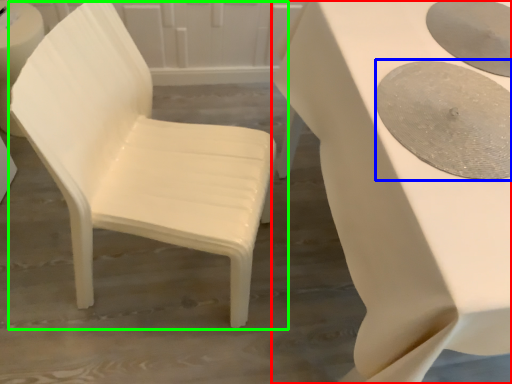
Question: Which is farther away from table (highlighted by a red box)? oval (highlighted by a blue box) or chair (highlighted by a green box)?

Choices:
 (A) oval
 (B) chair

Answer: (B)